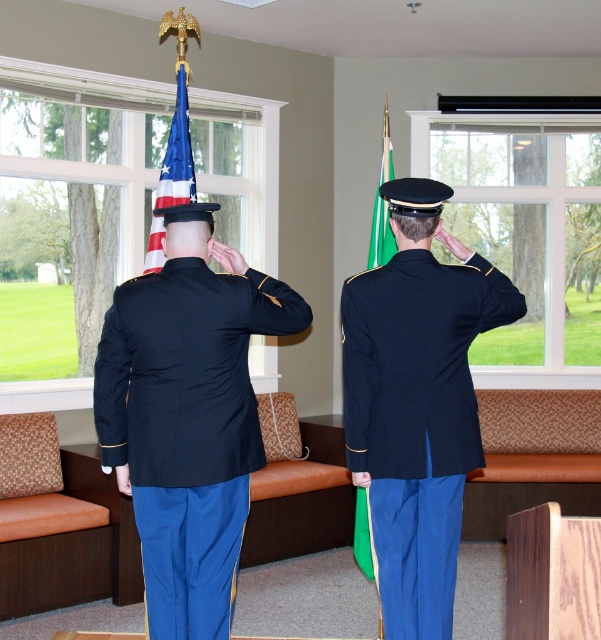
You are standing in the room where the two military personnel are saluting. You want to place a small decoration exactly at the point marked as point (182, 77). If you are currently 5 meters away from the window, can you reach the point without moving closer than 4 meters to it?

The distance of point (182, 77) from the viewer is 4.18 meters. Since you are currently 5 meters away from the window, you need to move closer to the point. However, since 4.18 meters is less than 5 meters, moving to 4.18 meters would bring you within the 4 meter limit. Therefore, you cannot reach the point without moving closer than 4 meters to it.

You are a photographer setting up a shot of the scene. You need to ensure that the matte black jacket at center and the american flag at center are both fully visible in the frame. Given that the camera has a fixed focal length, which object might require adjusting the camera angle to avoid cropping?

The matte black jacket at center might be wider than the american flag at center, so it might require adjusting the camera angle to ensure it fits within the frame without cropping.

You are an interior designer planning to place a new painting between the navy blue fabric jacket at center and the american flag at center. Which object should the painting be closer to based on their sizes?

The navy blue fabric jacket at center occupies less space than the american flag at center, so the painting should be placed closer to the navy blue fabric jacket at center to balance the visual weight.